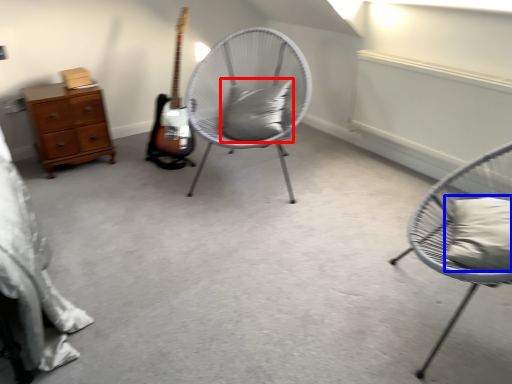
Question: Which object appears closest to the camera in this image, pillow (highlighted by a red box) or pillow (highlighted by a blue box)?

Choices:
 (A) pillow
 (B) pillow

Answer: (B)